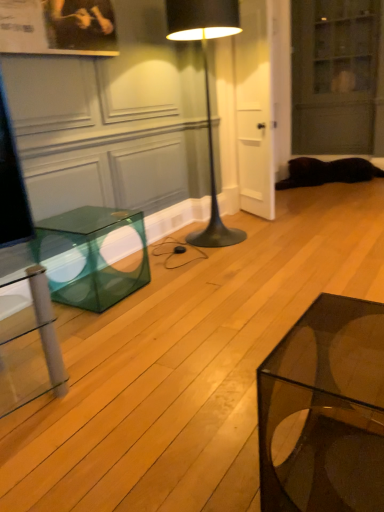
Find the location of `vacant space that is to the left of transparent glass coffee table at lower right`. vacant space that is to the left of transparent glass coffee table at lower right is located at coordinates (210, 458).